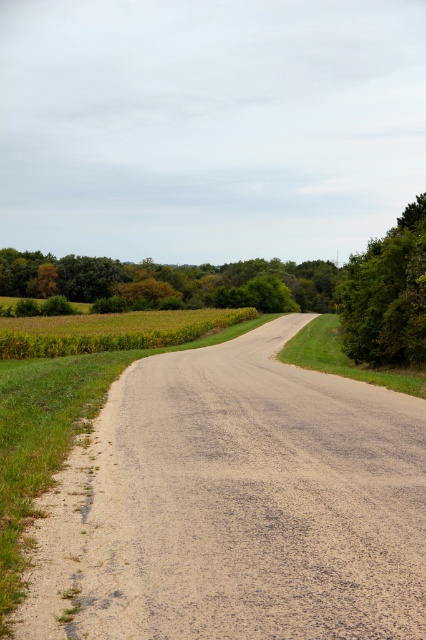
Question: Considering the real-world distances, which object is closest to the green grassy field at center-left?

Choices:
 (A) green leafy tree at right
 (B) green leafy trees at center
 (C) dull gray asphalt road at center

Answer: (A)

Question: Estimate the real-world distances between objects in this image. Which object is closer to the green leafy tree at right?

Choices:
 (A) green leafy trees at center
 (B) dull gray asphalt road at center
 (C) green grassy field at center-left

Answer: (B)

Question: Is green leafy trees at center below green grassy field at center-left?

Choices:
 (A) yes
 (B) no

Answer: (B)

Question: Which object appears closest to the camera in this image?

Choices:
 (A) green grassy field at center-left
 (B) green leafy trees at center
 (C) dull gray asphalt road at center

Answer: (C)

Question: Is green leafy tree at right thinner than green grassy field at center-left?

Choices:
 (A) yes
 (B) no

Answer: (A)

Question: Does green leafy trees at center appear on the right side of green grassy field at center-left?

Choices:
 (A) no
 (B) yes

Answer: (B)